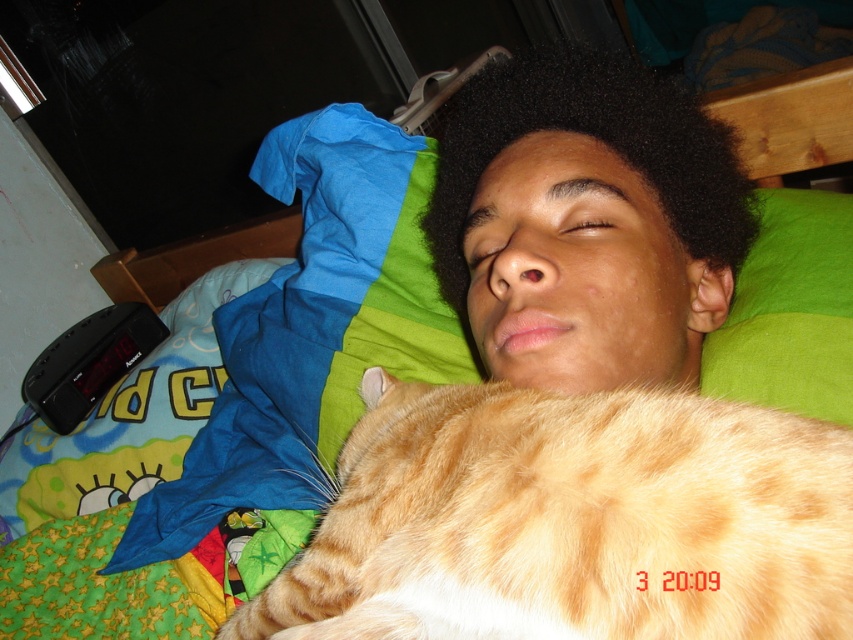
You are a night security guard checking the room. You see the orange fur cat at center and the black curly hair at center. Which one is closer to the left side of the bed?

The orange fur cat at center is closer to the left side of the bed because it is positioned to the left of the black curly hair at center.

You are a security camera monitoring the room. The orange fur cat at center is located at coordinates 0.814 on the x axis and 0.672 on the y axis. If the room has a 10x10 grid system where each unit is 1 meter, what are the cat coordinates in meters?

The orange fur cat at center is located at coordinates 0.814 on the x axis and 0.672 on the y axis. To convert to a 10x10 grid system, multiply each coordinate by 10. This results in approximately 8.14 meters on the x axis and 6.72 meters on the y axis. Therefore, the cat is at position 8.14m x 6.72m.

You are a sleep researcher analyzing the sleep positions of individuals in the image. Based on the positions of the orange fur cat at center and the black curly hair at center, which one is closer to the observer?

The orange fur cat at center is closer to the observer since it is positioned in front of the black curly hair at center.